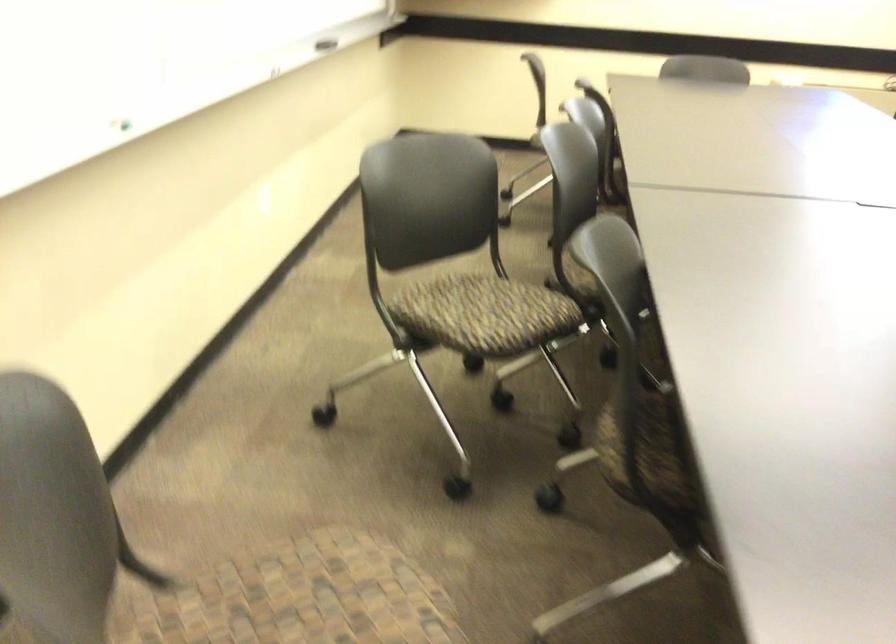
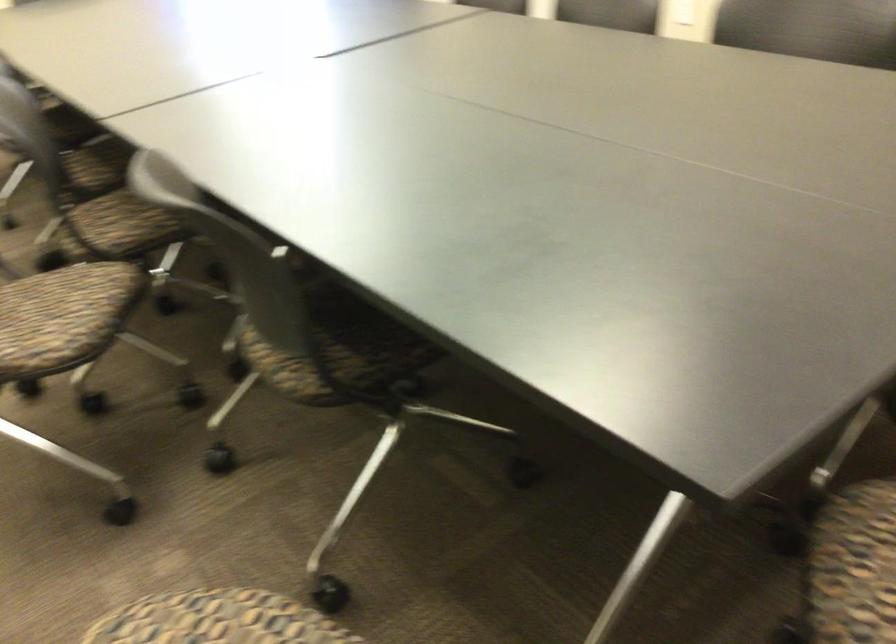
Question: The camera is either moving clockwise (left) or counter-clockwise (right) around the object. The first image is from the beginning of the video and the second image is from the end. Is the camera moving left or right when shooting the video?

Choices:
 (A) Left
 (B) Right

Answer: (A)